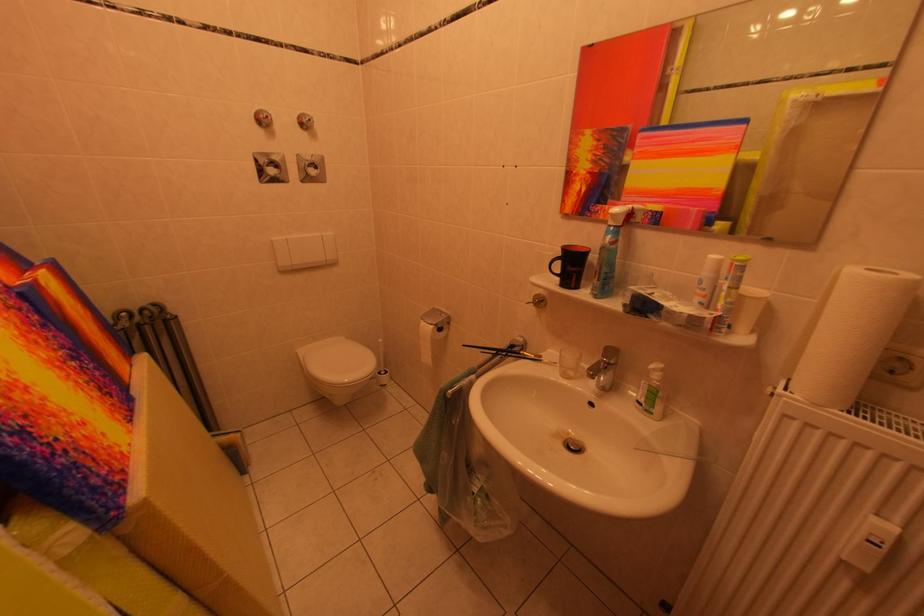
Where would you lift the chrome faucet handle? Please return your answer as a coordinate pair (x, y).

(608, 358)